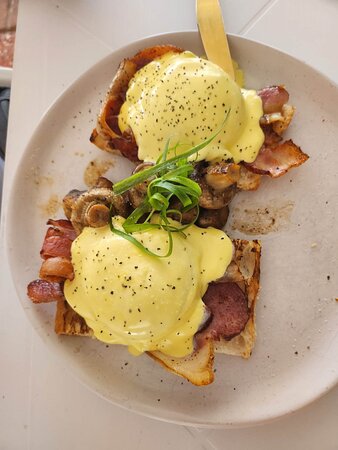
The height and width of the screenshot is (450, 338). Identify the location of tabletop. (27, 95).